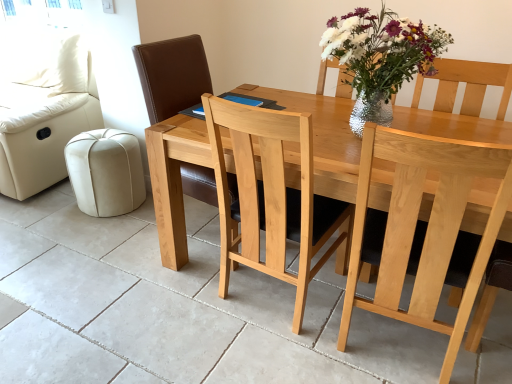
Question: From the image's perspective, is light wood chair at center, the 2th chair in the left-to-right sequence, positioned above or below natural wood chair at center, which appears as the second chair when viewed from the right?

Choices:
 (A) below
 (B) above

Answer: (A)

Question: Relative to natural wood chair at center, which appears as the second chair when viewed from the right, is light wood chair at center, the 2th chair in the left-to-right sequence, in front or behind?

Choices:
 (A) behind
 (B) front

Answer: (B)

Question: Estimate the real-world distances between objects in this image. Which object is closer to the natural wood chair at center, the first chair positioned from the left?

Choices:
 (A) beige leather ottoman at lower left
 (B) cream leather couch at left
 (C) natural wood table at center
 (D) light wood chair at center, which is the 1th chair from right to left

Answer: (C)

Question: Considering the real-world distances, which object is farthest from the natural wood chair at center, which appears as the second chair when viewed from the right?

Choices:
 (A) light wood chair at center, which is the 1th chair from right to left
 (B) beige leather ottoman at lower left
 (C) natural wood table at center
 (D) cream leather couch at left

Answer: (A)